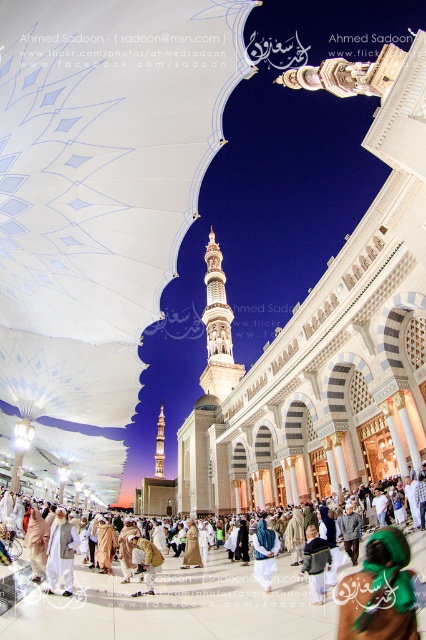
Between green fabric headscarf at lower right and golden fabric robe at center, which one appears on the left side from the viewer's perspective?

golden fabric robe at center

I want to click on green fabric headscarf at lower right, so click(380, 593).

Locate an element on the screen. The width and height of the screenshot is (426, 640). green fabric headscarf at lower right is located at coordinates (380, 593).

Between dark blue fabric at center and golden fabric robe at center, which one is positioned higher?

dark blue fabric at center is higher up.

Does dark blue fabric at center have a larger size compared to golden fabric robe at center?

No, dark blue fabric at center is not bigger than golden fabric robe at center.

Who is more forward, (313, 570) or (192, 554)?

Point (313, 570)

Identify the location of dark blue fabric at center. The width and height of the screenshot is (426, 640). (314, 563).

Is white fabric canopy at center to the left of green fabric headscarf at lower right from the viewer's perspective?

Indeed, white fabric canopy at center is positioned on the left side of green fabric headscarf at lower right.

Does white fabric canopy at center appear on the right side of green fabric headscarf at lower right?

No, white fabric canopy at center is not to the right of green fabric headscarf at lower right.

Where is `white fabric canopy at center`? white fabric canopy at center is located at coordinates (97, 205).